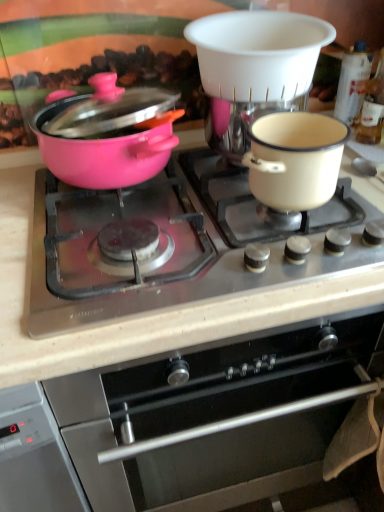
Question: From the image's perspective, is cream enamel pot at right below stainless steel oven at center?

Choices:
 (A) yes
 (B) no

Answer: (B)

Question: Does cream enamel pot at right have a greater width compared to stainless steel oven at center?

Choices:
 (A) yes
 (B) no

Answer: (B)

Question: From a real-world perspective, is cream enamel pot at right physically below stainless steel oven at center?

Choices:
 (A) yes
 (B) no

Answer: (B)

Question: Considering the relative sizes of cream enamel pot at right and stainless steel oven at center in the image provided, is cream enamel pot at right thinner than stainless steel oven at center?

Choices:
 (A) no
 (B) yes

Answer: (B)

Question: Does cream enamel pot at right appear on the right side of stainless steel oven at center?

Choices:
 (A) no
 (B) yes

Answer: (B)

Question: Considering their positions, is white plastic coffee machine at upper center located in front of or behind stainless steel oven at center?

Choices:
 (A) behind
 (B) front

Answer: (A)

Question: In terms of size, does white plastic coffee machine at upper center appear bigger or smaller than stainless steel oven at center?

Choices:
 (A) small
 (B) big

Answer: (A)

Question: Considering the positions of white plastic coffee machine at upper center and stainless steel oven at center in the image, is white plastic coffee machine at upper center wider or thinner than stainless steel oven at center?

Choices:
 (A) wide
 (B) thin

Answer: (B)

Question: Is white plastic coffee machine at upper center to the left or to the right of stainless steel oven at center in the image?

Choices:
 (A) left
 (B) right

Answer: (B)

Question: Looking at their shapes, would you say pink glossy pot at left is wider or thinner than cream enamel pot at right?

Choices:
 (A) wide
 (B) thin

Answer: (A)

Question: Is pink glossy pot at left inside the boundaries of cream enamel pot at right, or outside?

Choices:
 (A) inside
 (B) outside

Answer: (B)

Question: Is pink glossy pot at left in front of or behind cream enamel pot at right in the image?

Choices:
 (A) behind
 (B) front

Answer: (B)

Question: From a real-world perspective, is pink glossy pot at left above or below cream enamel pot at right?

Choices:
 (A) above
 (B) below

Answer: (A)

Question: Is pink glossy pot at left inside or outside of matte black cooktop at center?

Choices:
 (A) outside
 (B) inside

Answer: (A)

Question: From a real-world perspective, is pink glossy pot at left positioned above or below matte black cooktop at center?

Choices:
 (A) below
 (B) above

Answer: (B)